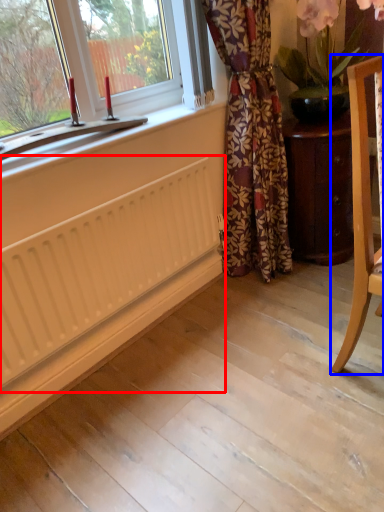
Question: Among these objects, which one is nearest to the camera, radiator (highlighted by a red box) or chair (highlighted by a blue box)?

Choices:
 (A) radiator
 (B) chair

Answer: (B)